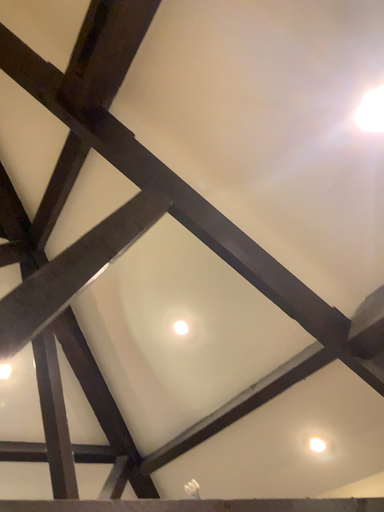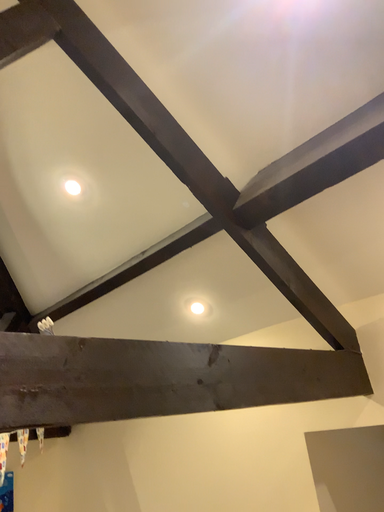
Question: How did the camera likely rotate when shooting the video?

Choices:
 (A) rotated upward
 (B) rotated downward

Answer: (B)